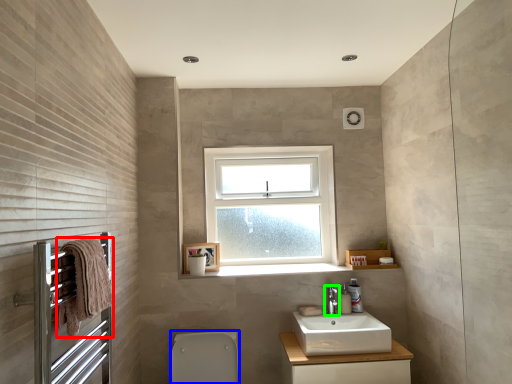
Question: Considering the real-world distances, which object is farthest from material (highlighted by a red box)? toilet bowl (highlighted by a blue box) or tap (highlighted by a green box)?

Choices:
 (A) toilet bowl
 (B) tap

Answer: (B)